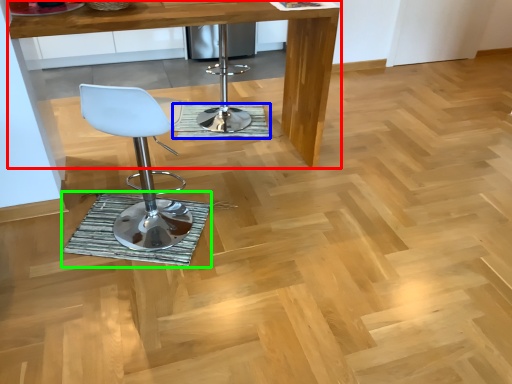
Question: Which is farther away from table (highlighted by a red box)? mat (highlighted by a blue box) or mat (highlighted by a green box)?

Choices:
 (A) mat
 (B) mat

Answer: (B)